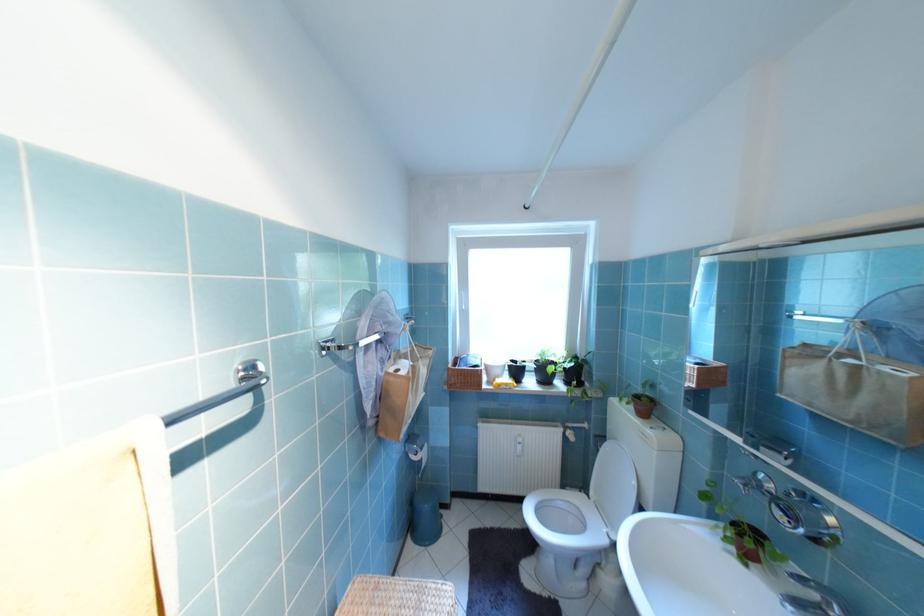
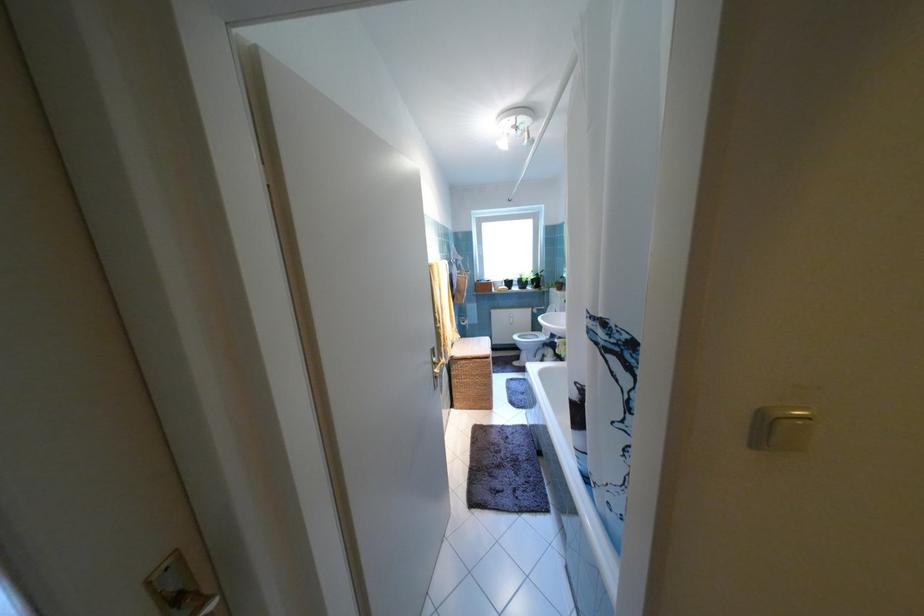
Locate, in the second image, the point that corresponds to point 527,371 in the first image.

(517, 284)